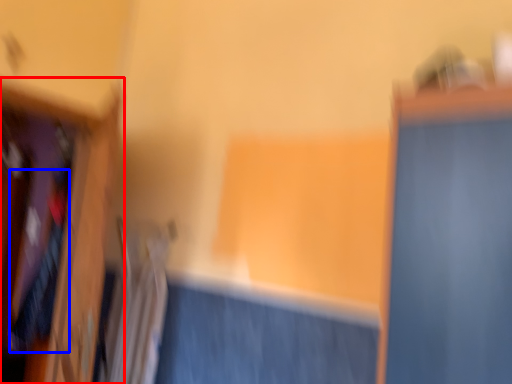
Question: Which point is closer to the camera, furniture (highlighted by a red box) or clothing (highlighted by a blue box)?

Choices:
 (A) furniture
 (B) clothing

Answer: (A)